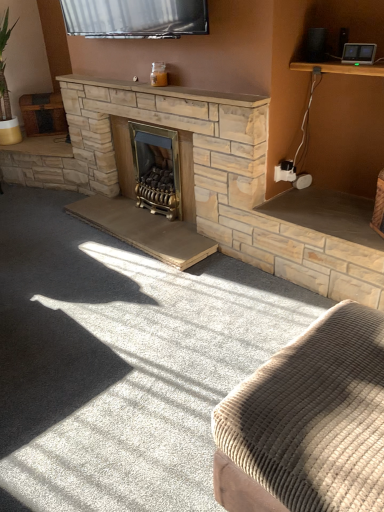
Image resolution: width=384 pixels, height=512 pixels. I want to click on vacant region above smooth stone mantle at upper center (from a real-world perspective), so click(x=167, y=89).